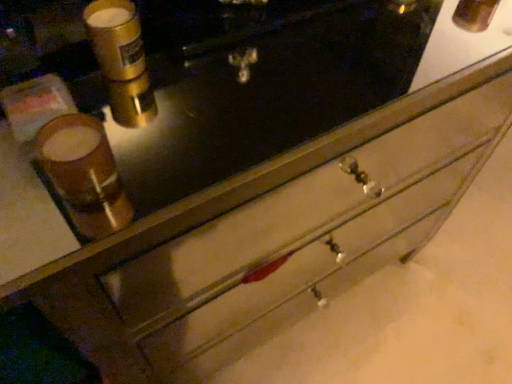
Question: From the image's perspective, is gold metallic canister at upper left, the 1th beverage in the top-to-bottom sequence, above or below matte brown cup at left, which is counted as the 1th beverage, starting from the front?

Choices:
 (A) below
 (B) above

Answer: (B)

Question: Considering the positions of gold metallic canister at upper left, placed as the second beverage when sorted from front to back, and matte brown cup at left, positioned as the first beverage in bottom-to-top order, in the image, is gold metallic canister at upper left, placed as the second beverage when sorted from front to back, wider or thinner than matte brown cup at left, positioned as the first beverage in bottom-to-top order,?

Choices:
 (A) thin
 (B) wide

Answer: (A)

Question: From a real-world perspective, relative to matte brown cup at left, positioned as the first beverage in bottom-to-top order, is gold metallic canister at upper left, acting as the first beverage starting from the back, vertically above or below?

Choices:
 (A) below
 (B) above

Answer: (A)

Question: Is matte brown cup at left, positioned as the first beverage in bottom-to-top order, taller or shorter than gold metallic canister at upper left, acting as the first beverage starting from the back?

Choices:
 (A) tall
 (B) short

Answer: (B)

Question: Does point pos(76,193) appear closer or farther from the camera than point pos(94,41)?

Choices:
 (A) farther
 (B) closer

Answer: (B)

Question: Relative to gold metallic canister at upper left, the 1th beverage in the top-to-bottom sequence, is matte brown cup at left, which is counted as the 1th beverage, starting from the front, in front or behind?

Choices:
 (A) behind
 (B) front

Answer: (B)

Question: Based on their positions, is matte brown cup at left, positioned as the first beverage in bottom-to-top order, located to the left or right of gold metallic canister at upper left, positioned as the 2th beverage in bottom-to-top order?

Choices:
 (A) left
 (B) right

Answer: (A)